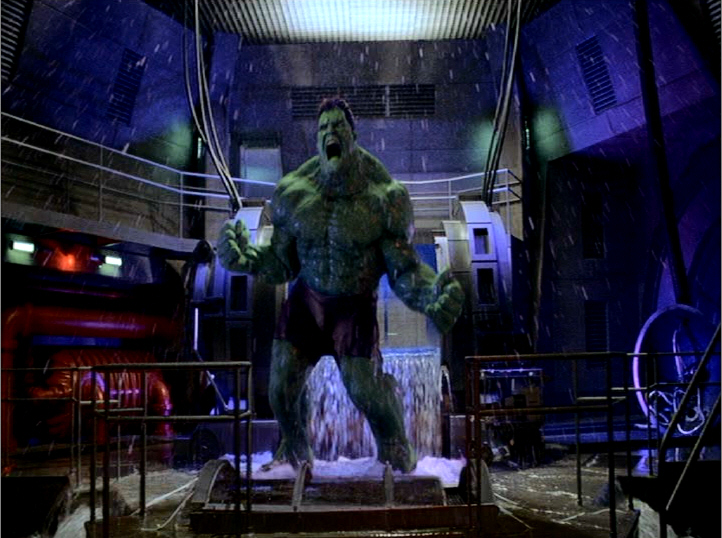
The image size is (722, 538). What are the coordinates of `lighting` in the screenshot? It's located at (107, 263), (74, 259), (247, 25).